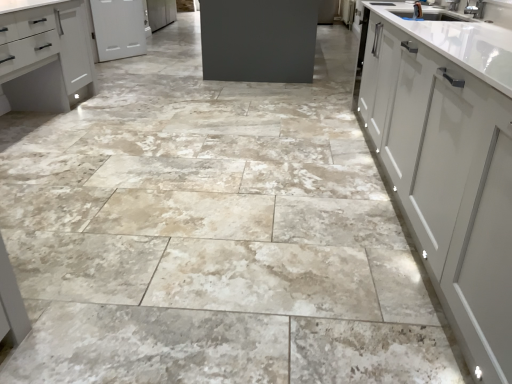
Question: From their relative heights in the image, would you say white matte cabinet at upper left, which is counted as the second cabinetry, starting from the bottom, is taller or shorter than matte white cabinet at left, which ranks as the 2th cabinetry in back-to-front order?

Choices:
 (A) short
 (B) tall

Answer: (A)

Question: Which is correct: white matte cabinet at upper left, which is counted as the second cabinetry, starting from the bottom, is inside matte white cabinet at left, which appears as the first cabinetry when ordered from the bottom, or outside of it?

Choices:
 (A) inside
 (B) outside

Answer: (B)

Question: From a real-world perspective, is white matte cabinet at upper left, arranged as the 1th cabinetry when viewed from the back, physically located above or below matte white cabinet at left, the second cabinetry positioned from the top?

Choices:
 (A) above
 (B) below

Answer: (B)

Question: From their relative heights in the image, would you say matte white cabinet at left, which ranks as the 2th cabinetry in back-to-front order, is taller or shorter than white matte cabinet at upper left, marked as the first cabinetry in a top-to-bottom arrangement?

Choices:
 (A) tall
 (B) short

Answer: (A)

Question: From a real-world perspective, relative to white matte cabinet at upper left, arranged as the 1th cabinetry when viewed from the back, is matte white cabinet at left, which ranks as the 2th cabinetry in back-to-front order, vertically above or below?

Choices:
 (A) above
 (B) below

Answer: (A)

Question: Visually, is matte white cabinet at left, arranged as the first cabinetry when viewed from the front, positioned to the left or to the right of white matte cabinet at upper left, the second cabinetry from the front?

Choices:
 (A) right
 (B) left

Answer: (B)

Question: Looking at their shapes, would you say matte white cabinet at left, arranged as the first cabinetry when viewed from the front, is wider or thinner than white matte cabinet at upper left, which is counted as the second cabinetry, starting from the bottom?

Choices:
 (A) thin
 (B) wide

Answer: (B)